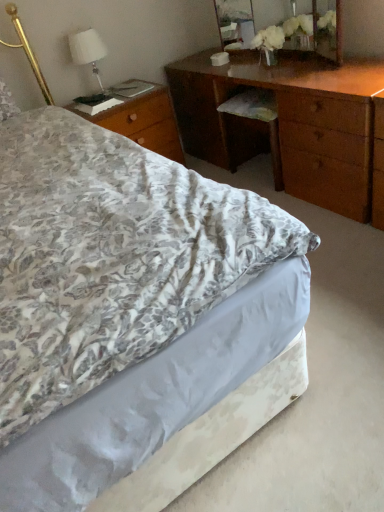
Question: Can you confirm if white fabric lampshade at upper left is thinner than wooden nightstand at left?

Choices:
 (A) no
 (B) yes

Answer: (B)

Question: Does white fabric lampshade at upper left come behind wooden nightstand at left?

Choices:
 (A) no
 (B) yes

Answer: (B)

Question: Is wooden nightstand at left at the back of white fabric lampshade at upper left?

Choices:
 (A) yes
 (B) no

Answer: (B)

Question: Is white fabric lampshade at upper left at the right side of wooden nightstand at left?

Choices:
 (A) yes
 (B) no

Answer: (B)

Question: Considering the relative sizes of white fabric lampshade at upper left and wooden nightstand at left in the image provided, is white fabric lampshade at upper left smaller than wooden nightstand at left?

Choices:
 (A) yes
 (B) no

Answer: (A)

Question: Could you tell me if white fabric lampshade at upper left is facing wooden nightstand at left?

Choices:
 (A) yes
 (B) no

Answer: (B)

Question: Does floral fabric bed at center have a lesser height compared to wooden mirror at upper center?

Choices:
 (A) yes
 (B) no

Answer: (A)

Question: Does floral fabric bed at center have a larger size compared to wooden mirror at upper center?

Choices:
 (A) no
 (B) yes

Answer: (B)

Question: Does floral fabric bed at center come in front of wooden mirror at upper center?

Choices:
 (A) no
 (B) yes

Answer: (B)

Question: Is floral fabric bed at center in contact with wooden mirror at upper center?

Choices:
 (A) yes
 (B) no

Answer: (B)

Question: From the image's perspective, is floral fabric bed at center below wooden mirror at upper center?

Choices:
 (A) no
 (B) yes

Answer: (B)

Question: Is floral fabric bed at center positioned with its back to wooden mirror at upper center?

Choices:
 (A) no
 (B) yes

Answer: (A)

Question: From the image's perspective, does wooden nightstand at left appear lower than floral fabric bed at center?

Choices:
 (A) yes
 (B) no

Answer: (B)